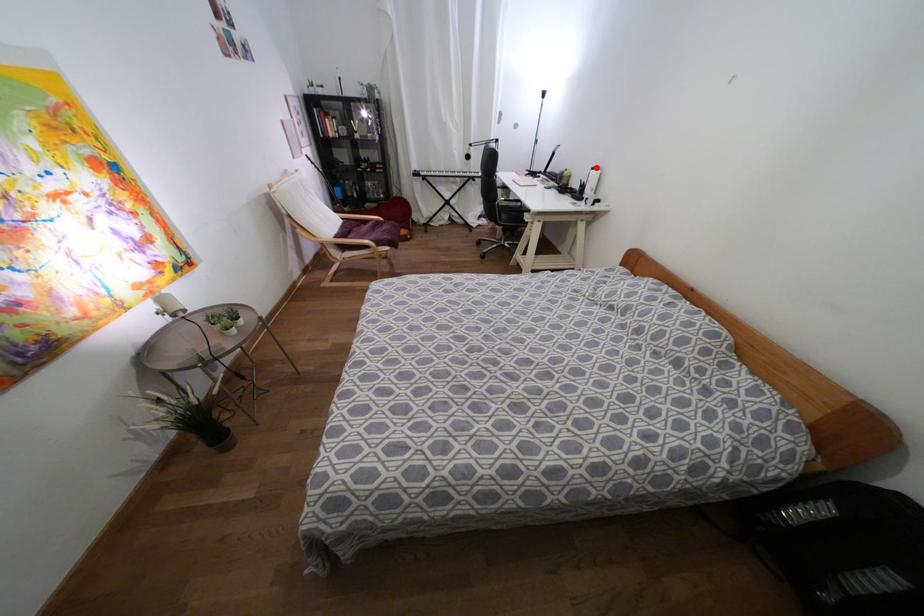
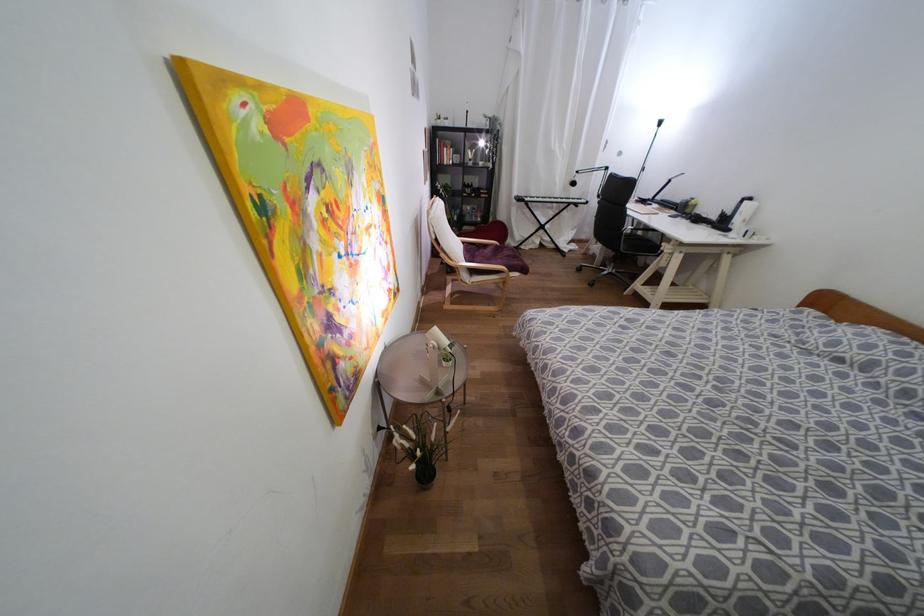
In the second image, find the point that corresponds to the highlighted location in the first image.

(749, 198)